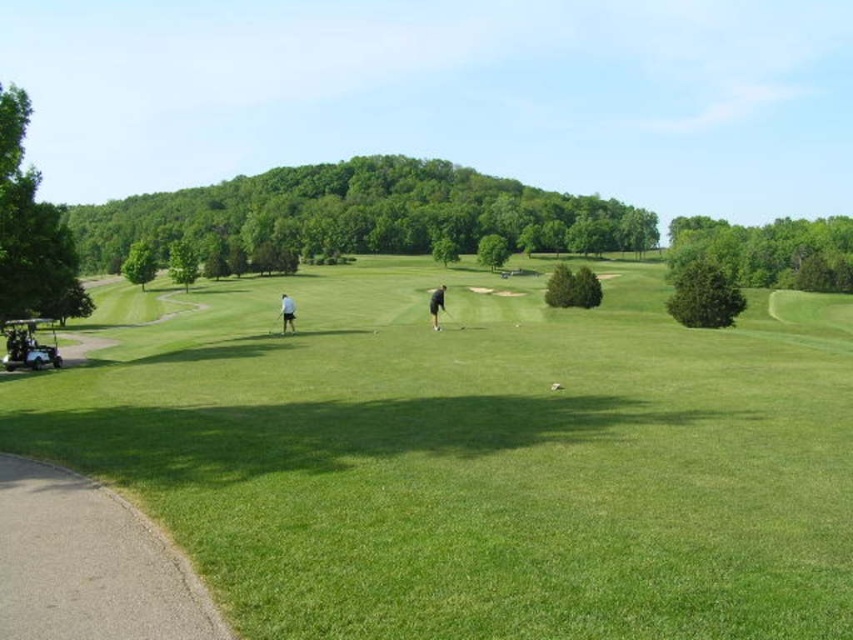
You are a golfer standing at the starting point of the golf course. You see the matte black golf cart at lower left and the black rubber golf club at center. Which object is closer to you?

The matte black golf cart at lower left is positioned under the black rubber golf club at center, meaning it is closer to you.

You are a golfer standing on the pathway at the lower left corner of the golf course. You want to reach the dark gray pants at center without stepping off the pathway. Is the matte black golf cart at lower left blocking your path?

The matte black golf cart at lower left is to the left of dark gray pants at center, so it is positioned off to the side of the pathway. Therefore, the matte black golf cart at lower left is not blocking your path to the dark gray pants at center.